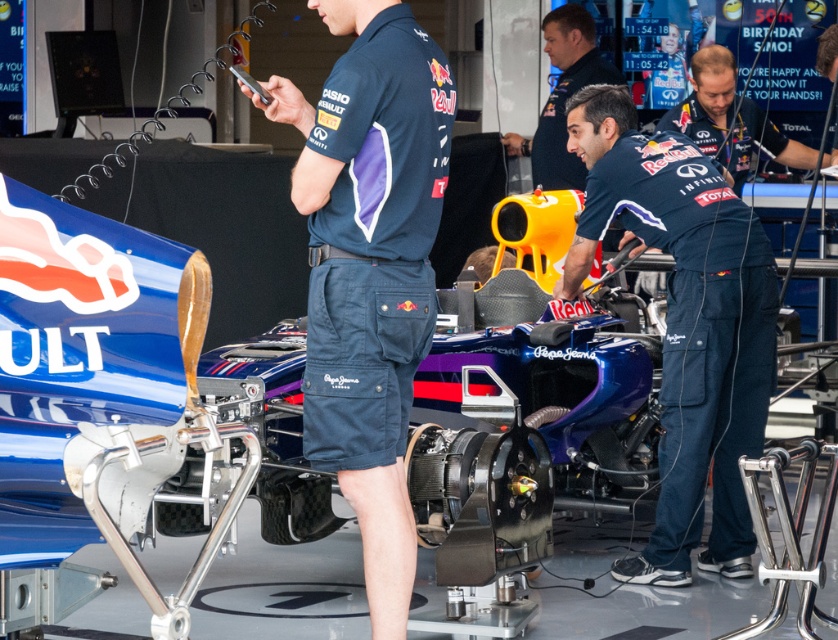
Question: In this image, where is navy blue shorts at center located relative to matte blue uniform at center?

Choices:
 (A) left
 (B) right

Answer: (A)

Question: Among these points, which one is nearest to the camera?

Choices:
 (A) (551, 131)
 (B) (754, 374)
 (C) (379, 58)

Answer: (C)

Question: Is navy blue shorts at center smaller than matte blue jumpsuit at center?

Choices:
 (A) no
 (B) yes

Answer: (B)

Question: Can you confirm if blue carbon fiber race car at center is positioned to the right of navy blue shorts at center?

Choices:
 (A) yes
 (B) no

Answer: (B)

Question: Which point appears farthest from the camera in this image?

Choices:
 (A) (707, 124)
 (B) (360, 33)

Answer: (A)

Question: Based on their relative distances, which object is nearer to the blue carbon fiber race car at center?

Choices:
 (A) matte blue jumpsuit at center
 (B) navy blue shorts at center
 (C) matte blue uniform at center
 (D) dark blue uniform at center

Answer: (B)